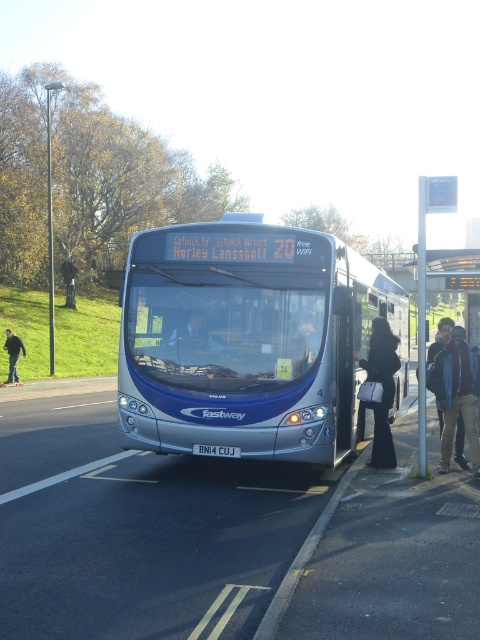
Looking at this image, does black leather handbag at center appear on the left side of dark blue jeans at lower left?

Incorrect, black leather handbag at center is not on the left side of dark blue jeans at lower left.

Which is in front, point (387, 436) or point (13, 371)?

Point (387, 436) is more forward.

Is point (372, 465) positioned before point (11, 355)?

Yes, it is in front of point (11, 355).

Locate an element on the screen. This screenshot has width=480, height=640. black leather handbag at center is located at coordinates (384, 372).

Is blue denim jacket at center bigger than black leather handbag at center?

Indeed, blue denim jacket at center has a larger size compared to black leather handbag at center.

Is the position of blue denim jacket at center less distant than that of black leather handbag at center?

Yes.

Where is `blue denim jacket at center`? This screenshot has width=480, height=640. blue denim jacket at center is located at coordinates (456, 394).

Consider the image. Who is taller, matte blue bus at center or dark blue jeans at lower left?

Standing taller between the two is dark blue jeans at lower left.

Does point (215, 353) lie in front of point (12, 332)?

That is True.

This screenshot has width=480, height=640. What are the coordinates of `matte blue bus at center` in the screenshot? It's located at (194, 336).